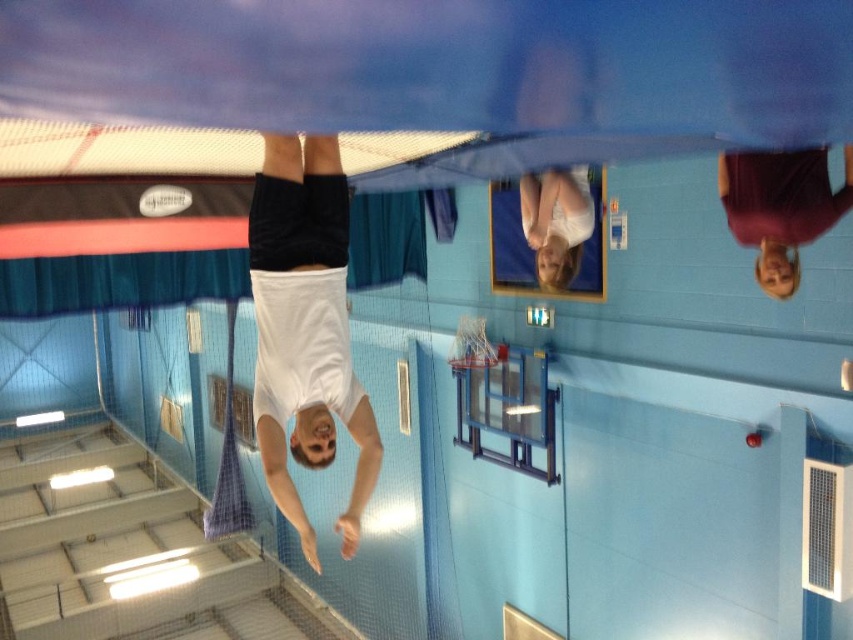
Question: Which of the following is the farthest from the observer?

Choices:
 (A) maroon fabric shirt at upper right
 (B) white fabric at upper center
 (C) white matte shirt at center

Answer: (B)

Question: Can you confirm if white matte shirt at center is wider than maroon fabric shirt at upper right?

Choices:
 (A) no
 (B) yes

Answer: (A)

Question: Which object is farther from the camera taking this photo?

Choices:
 (A) white matte shirt at center
 (B) maroon fabric shirt at upper right
 (C) white fabric at upper center

Answer: (C)

Question: Which object appears farthest from the camera in this image?

Choices:
 (A) white matte shirt at center
 (B) maroon fabric shirt at upper right

Answer: (B)

Question: Considering the relative positions of white matte shirt at center and white fabric at upper center in the image provided, where is white matte shirt at center located with respect to white fabric at upper center?

Choices:
 (A) below
 (B) above

Answer: (A)

Question: In this image, where is white matte shirt at center located relative to maroon fabric shirt at upper right?

Choices:
 (A) right
 (B) left

Answer: (B)